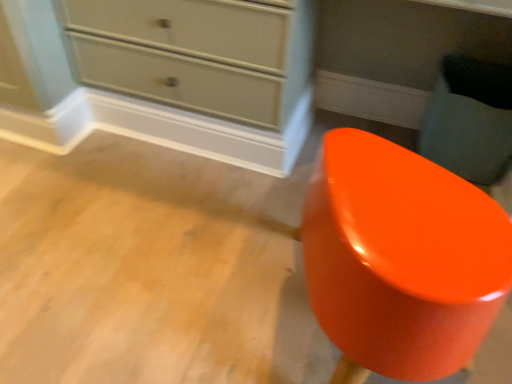
Question: From the image's perspective, relative to glossy orange stool at lower right, is glossy orange stool at lower right above or below?

Choices:
 (A) below
 (B) above

Answer: (B)

Question: Is glossy orange stool at lower right in front of or behind glossy orange stool at lower right in the image?

Choices:
 (A) behind
 (B) front

Answer: (A)

Question: Does point (503, 152) appear closer or farther from the camera than point (509, 241)?

Choices:
 (A) closer
 (B) farther

Answer: (B)

Question: In terms of size, does glossy orange stool at lower right appear bigger or smaller than glossy orange stool at lower right?

Choices:
 (A) big
 (B) small

Answer: (A)

Question: Would you say glossy orange stool at lower right is to the left or to the right of glossy orange stool at lower right in the picture?

Choices:
 (A) left
 (B) right

Answer: (A)

Question: Considering their positions, is glossy orange stool at lower right located in front of or behind glossy orange stool at lower right?

Choices:
 (A) behind
 (B) front

Answer: (B)

Question: Is glossy orange stool at lower right inside or outside of glossy orange stool at lower right?

Choices:
 (A) outside
 (B) inside

Answer: (A)